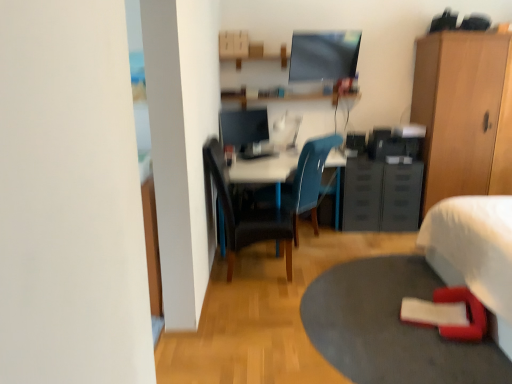
Question: Is white glossy computer desk at center wider than matte blue chair at center, which is the first chair from back to front?

Choices:
 (A) no
 (B) yes

Answer: (B)

Question: Is white glossy computer desk at center next to matte blue chair at center, which is the first chair from back to front, and touching it?

Choices:
 (A) yes
 (B) no

Answer: (B)

Question: Would you say white glossy computer desk at center is outside matte blue chair at center, which is the first chair from back to front?

Choices:
 (A) no
 (B) yes

Answer: (B)

Question: From a real-world perspective, does white glossy computer desk at center stand above matte blue chair at center, which is the first chair from back to front?

Choices:
 (A) no
 (B) yes

Answer: (A)

Question: From a real-world perspective, is white glossy computer desk at center beneath matte blue chair at center, which ranks as the second chair in front-to-back order?

Choices:
 (A) yes
 (B) no

Answer: (A)

Question: Does white glossy computer desk at center have a larger size compared to matte blue chair at center, which is the first chair from back to front?

Choices:
 (A) no
 (B) yes

Answer: (B)

Question: Does white fabric bed at lower right have a larger size compared to white glossy computer desk at center?

Choices:
 (A) no
 (B) yes

Answer: (B)

Question: Does white fabric bed at lower right have a lesser height compared to white glossy computer desk at center?

Choices:
 (A) yes
 (B) no

Answer: (B)

Question: Is white fabric bed at lower right turned away from white glossy computer desk at center?

Choices:
 (A) yes
 (B) no

Answer: (B)

Question: Does white fabric bed at lower right have a greater height compared to white glossy computer desk at center?

Choices:
 (A) yes
 (B) no

Answer: (A)

Question: Is white fabric bed at lower right not within white glossy computer desk at center?

Choices:
 (A) no
 (B) yes

Answer: (B)

Question: Is the depth of white fabric bed at lower right less than that of white glossy computer desk at center?

Choices:
 (A) no
 (B) yes

Answer: (B)

Question: Does black leather chair at center, which appears as the 2th chair when viewed from the back, have a lesser height compared to white glossy computer desk at center?

Choices:
 (A) no
 (B) yes

Answer: (A)